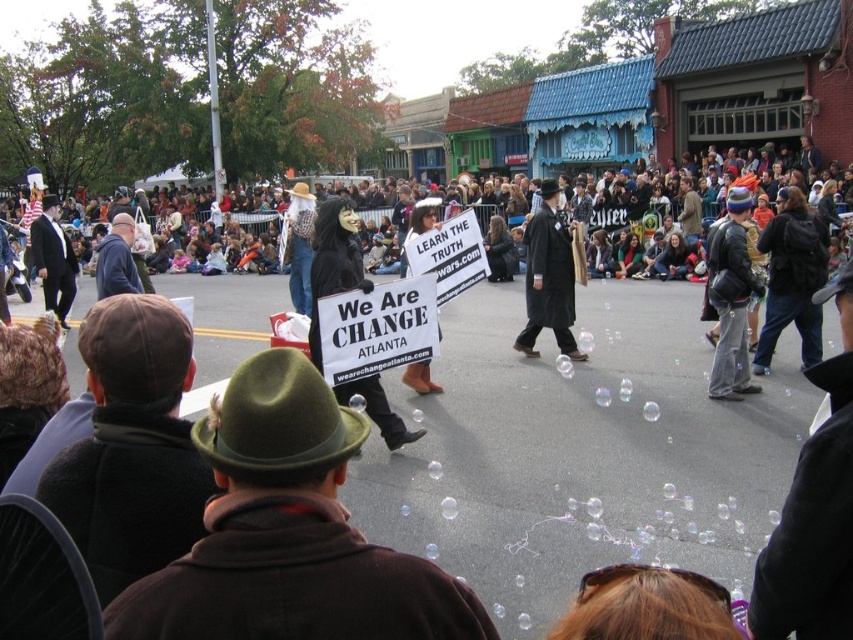
Question: Is denim jacket at center behind white paper sign at center?

Choices:
 (A) yes
 (B) no

Answer: (A)

Question: Does denim jacket at center have a greater width compared to black wool coat at center?

Choices:
 (A) yes
 (B) no

Answer: (A)

Question: Which of the following is the closest to the observer?

Choices:
 (A) (538, 285)
 (B) (740, 339)
 (C) (433, 196)
 (D) (277, 218)

Answer: (B)

Question: Among these points, which one is nearest to the camera?

Choices:
 (A) coord(538,266)
 (B) coord(462,208)
 (C) coord(428,205)

Answer: (C)

Question: Is the position of denim jacket at center less distant than that of black matte mask at center?

Choices:
 (A) no
 (B) yes

Answer: (A)

Question: Which is farther from the denim jacket at center?

Choices:
 (A) white paper sign at center
 (B) black matte mask at center

Answer: (B)